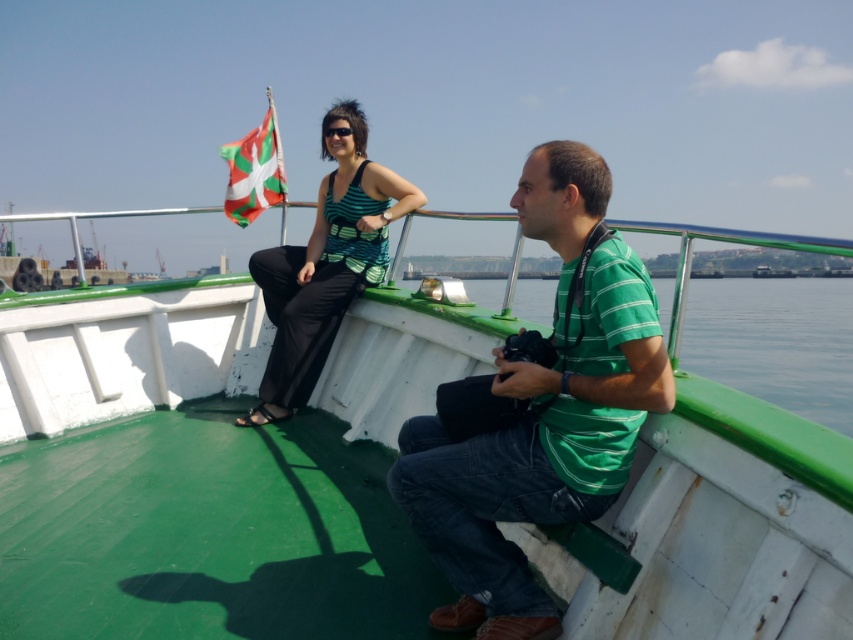
Can you confirm if green striped shirt at center is positioned above white and green fabric flag at upper left?

No.

Is point (585, 344) farther from camera compared to point (230, 212)?

No, (585, 344) is closer to viewer.

Measure the distance between point (526, 212) and camera.

A distance of 1.86 meters exists between point (526, 212) and camera.

Find the location of a particular element. This screenshot has width=853, height=640. green striped shirt at center is located at coordinates (543, 412).

Does green matte boat at center come in front of green striped shirt at center?

That is False.

I want to click on green matte boat at center, so pos(715,508).

Is point (155, 396) positioned before point (482, 586)?

No, (155, 396) is behind (482, 586).

Image resolution: width=853 pixels, height=640 pixels. I want to click on green matte boat at center, so click(715, 508).

Which is behind, point (712, 444) or point (260, 147)?

Point (260, 147)

The height and width of the screenshot is (640, 853). Identify the location of green matte boat at center. (715, 508).